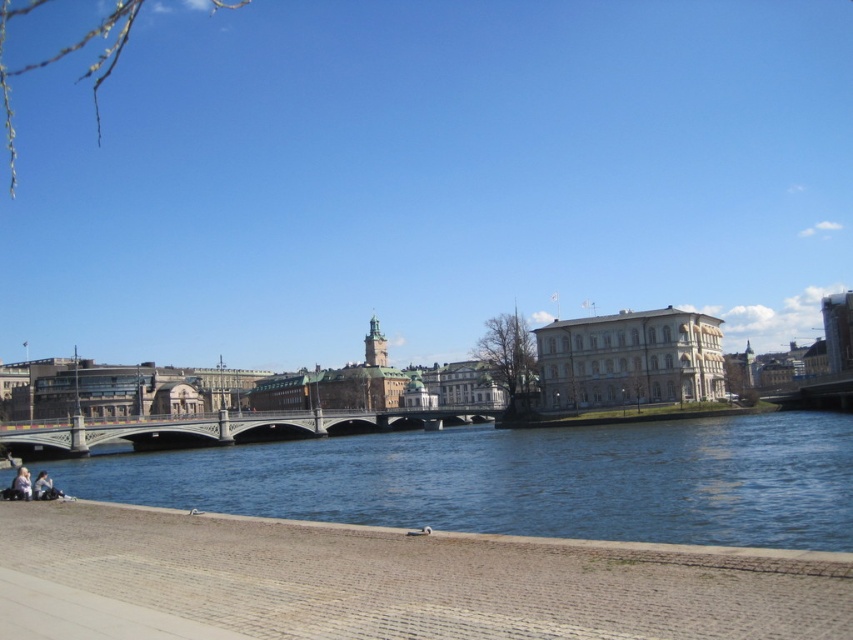
Looking at this image, is blue water at lower center closer to camera compared to light blue denim jeans at lower left?

Yes, it is in front of light blue denim jeans at lower left.

Based on the photo, does blue water at lower center have a larger size compared to light blue denim jeans at lower left?

Indeed, blue water at lower center has a larger size compared to light blue denim jeans at lower left.

Which is behind, point (480, 465) or point (28, 481)?

The point (480, 465) is more distant.

I want to click on blue water at lower center, so click(x=521, y=480).

Is point (747, 502) positioned behind point (126, 438)?

No, (747, 502) is in front of (126, 438).

Can you confirm if blue water at lower center is thinner than white stone bridge at center?

Incorrect, blue water at lower center's width is not less than white stone bridge at center's.

Find the location of a particular element. blue water at lower center is located at coordinates (521, 480).

Is point (427, 413) less distant than point (22, 474)?

No, (427, 413) is further to viewer.

Image resolution: width=853 pixels, height=640 pixels. I want to click on white stone bridge at center, so click(x=222, y=428).

Identify the location of white stone bridge at center. (222, 428).